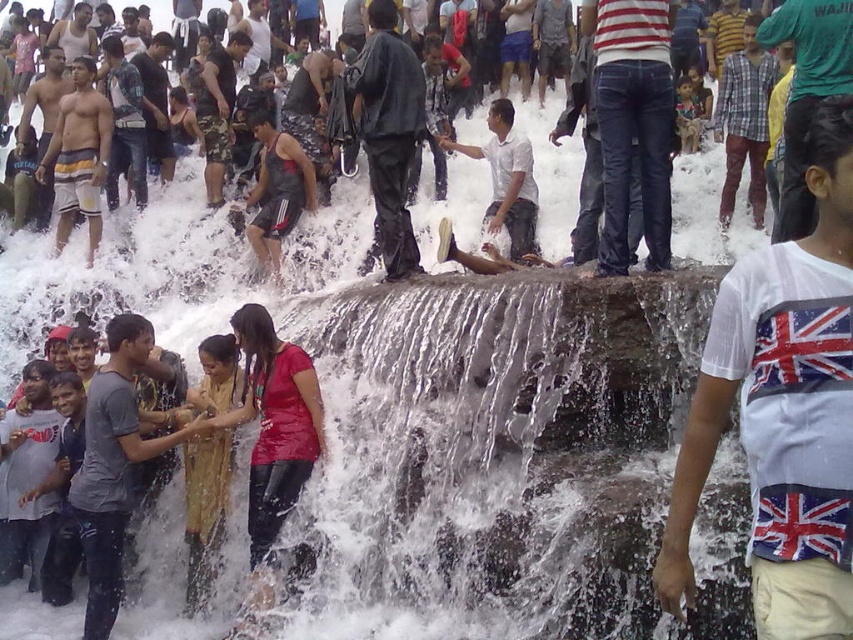
Can you confirm if white cotton t-shirt at center is positioned below striped shorts at left?

Yes, white cotton t-shirt at center is below striped shorts at left.

Where is `white cotton t-shirt at center`? This screenshot has height=640, width=853. white cotton t-shirt at center is located at coordinates coord(782,410).

Is point (776, 326) positioned in front of point (62, 179)?

Yes.

In order to click on white cotton t-shirt at center in this screenshot , I will do `click(782, 410)`.

Is black matte pants at center further to the viewer compared to matte black shorts at center?

No, black matte pants at center is in front of matte black shorts at center.

Can you confirm if black matte pants at center is bigger than matte black shorts at center?

Indeed, black matte pants at center has a larger size compared to matte black shorts at center.

Between point (409, 144) and point (259, 209), which one is positioned in front?

Point (409, 144) is more forward.

In order to click on black matte pants at center in this screenshot , I will do `click(389, 131)`.

Who is lower down, black matte pants at center or striped shorts at left?

striped shorts at left is lower down.

Image resolution: width=853 pixels, height=640 pixels. I want to click on black matte pants at center, so click(389, 131).

Locate an element on the screen. This screenshot has width=853, height=640. black matte pants at center is located at coordinates (389, 131).